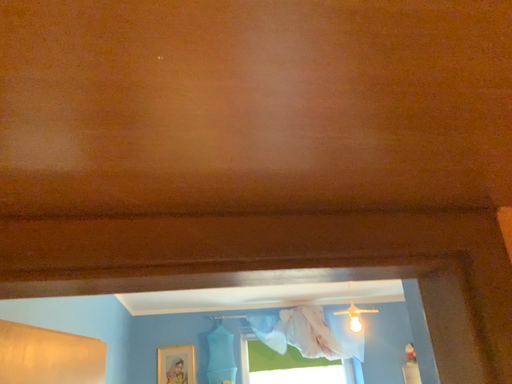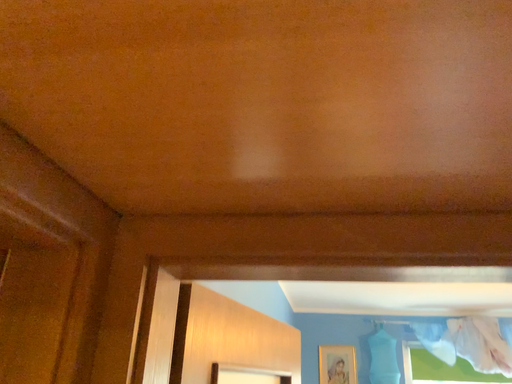
Question: How did the camera likely rotate when shooting the video?

Choices:
 (A) rotated right
 (B) rotated left

Answer: (B)